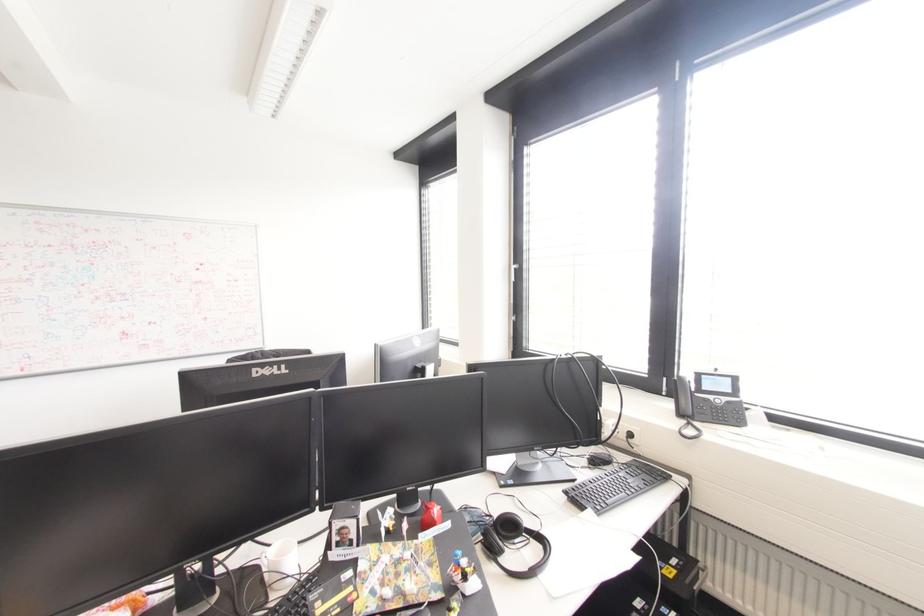
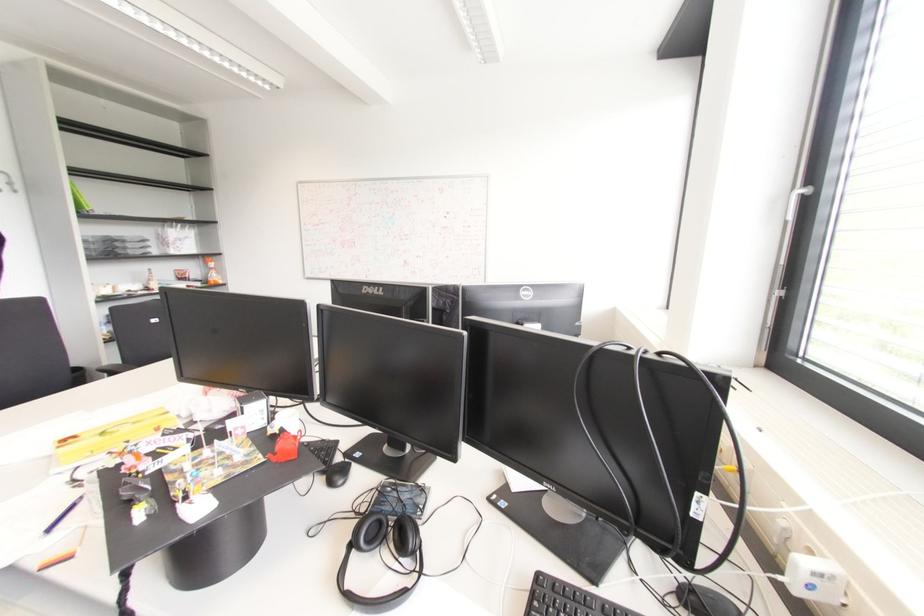
Question: Based on the continuous images, in which direction is the camera rotating? Reply with the corresponding letter.

Choices:
 (A) Left
 (B) Right
 (C) Up
 (D) Down

Answer: (A)